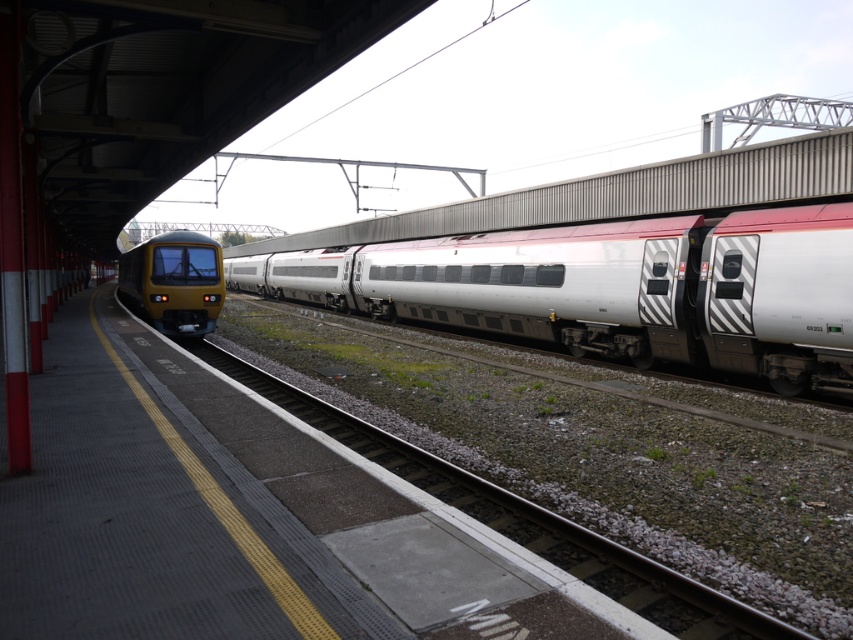
Who is positioned more to the right, gravel at left or metallic yellow train at left?

From the viewer's perspective, gravel at left appears more on the right side.

Is gravel at left thinner than metallic yellow train at left?

Indeed, gravel at left has a lesser width compared to metallic yellow train at left.

Between point (515, 499) and point (184, 282), which one is positioned behind?

The point (184, 282) is behind.

Where is `gravel at left`? gravel at left is located at coordinates (524, 518).

Is point (664, 228) more distant than point (194, 257)?

No.

From the picture: Does silver/white metallic train at center lie in front of metallic yellow train at left?

Yes, silver/white metallic train at center is in front of metallic yellow train at left.

Find the location of `silver/white metallic train at center`. silver/white metallic train at center is located at coordinates [613, 289].

Does silver/white metallic train at center have a greater height compared to gravel at left?

Yes.

From the picture: Between silver/white metallic train at center and gravel at left, which one appears on the right side from the viewer's perspective?

Positioned to the right is silver/white metallic train at center.

Which is in front, point (820, 220) or point (544, 540)?

Positioned in front is point (544, 540).

Where is `silver/white metallic train at center`? The image size is (853, 640). silver/white metallic train at center is located at coordinates (613, 289).